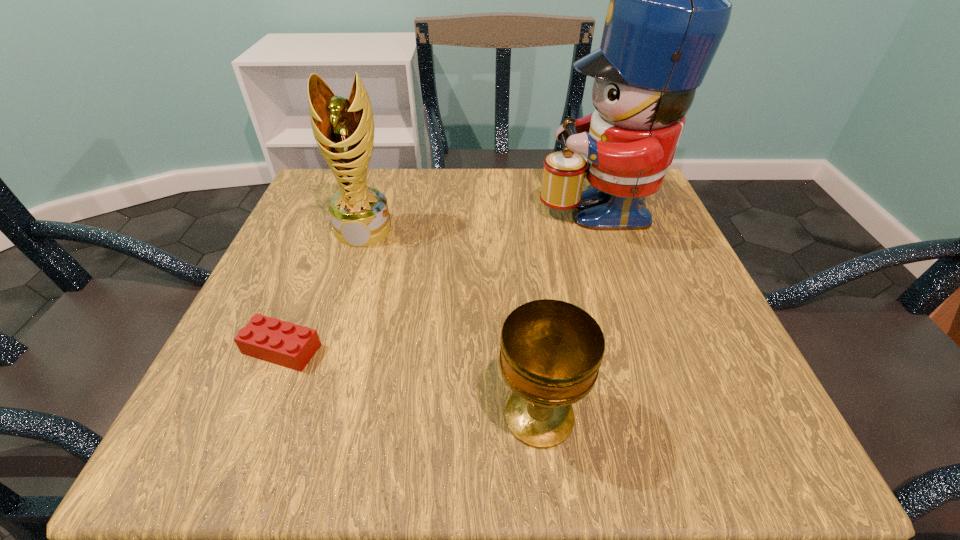
Where is `the tallest object`? the tallest object is located at coordinates (669, 9).

Identify the location of award. The width and height of the screenshot is (960, 540). (343, 128).

I want to click on the nearest object, so pos(551,351).

Where is `chalice`? The width and height of the screenshot is (960, 540). chalice is located at coordinates (551, 351).

Locate an element on the screen. the shortest object is located at coordinates (283, 343).

What are the coordinates of `Lego` in the screenshot? It's located at pos(283,343).

This screenshot has height=540, width=960. Find the location of `free location located on the front-facing side of the nutcracker`. free location located on the front-facing side of the nutcracker is located at coordinates (487, 205).

Identify the location of vacant space located on the front-facing side of the nutcracker. point(382,205).

Find the location of a particular element. vacant space located on the front-facing side of the nutcracker is located at coordinates (510, 205).

Find the location of a particular element. vacant space situated 0.210m on the front-facing side of the award is located at coordinates (331, 330).